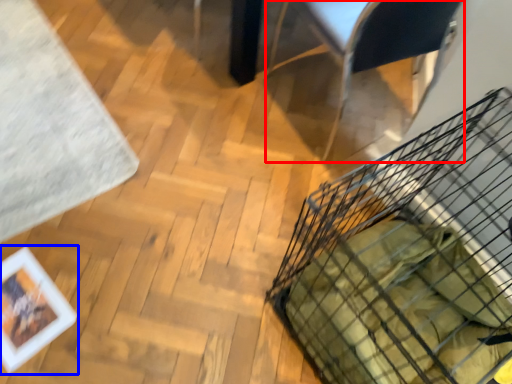
Question: Among these objects, which one is nearest to the camera, armchair (highlighted by a red box) or picture frame (highlighted by a blue box)?

Choices:
 (A) armchair
 (B) picture frame

Answer: (A)